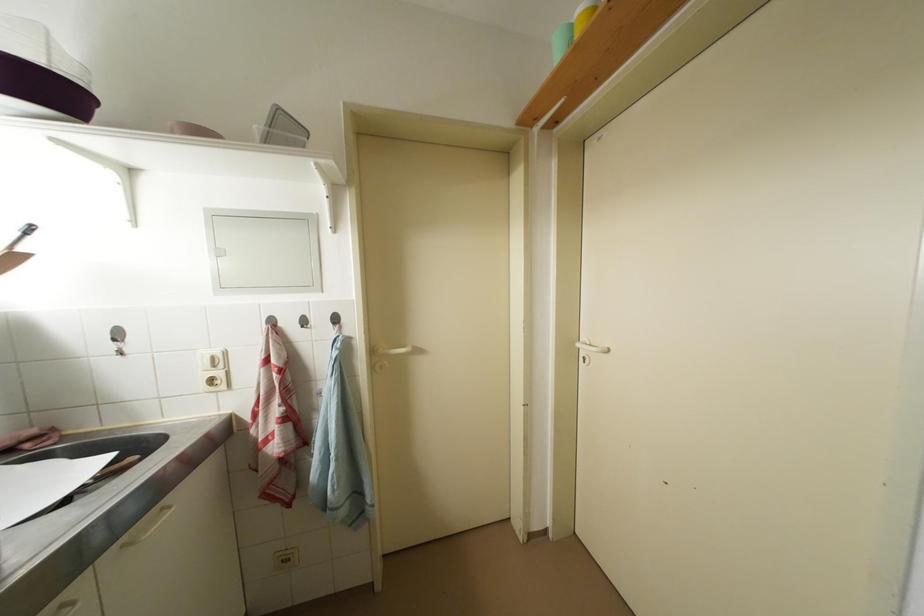
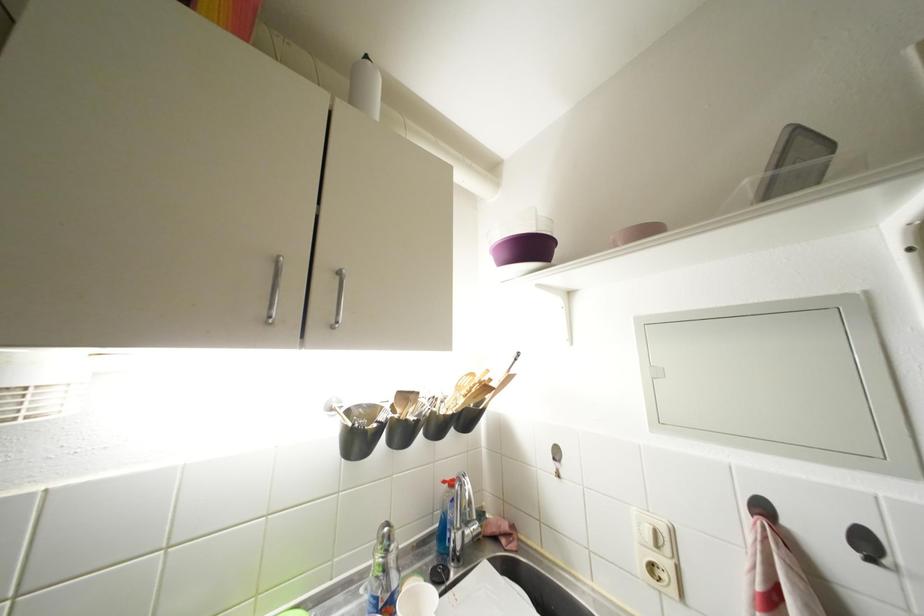
In the second image, find the point that corresponds to (278,325) in the first image.

(770, 513)